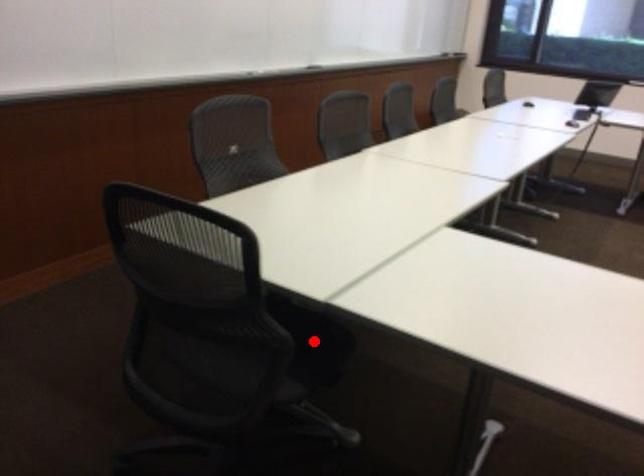
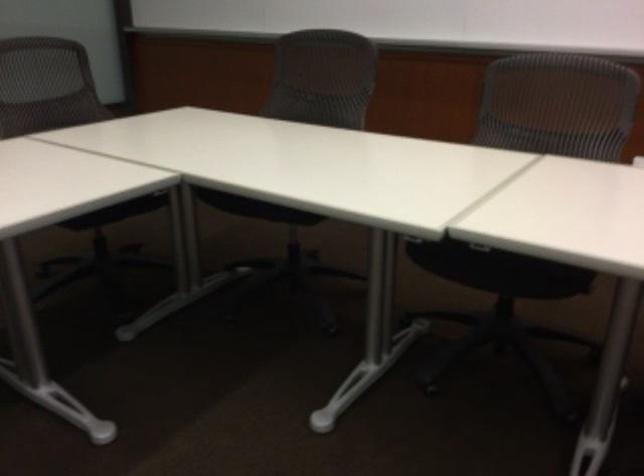
Question: I am providing you with two images of the same scene from different viewpoints. A red point is marked on the first image. Is the red point's position out of view in image 2?

Choices:
 (A) Yes
 (B) No

Answer: (A)